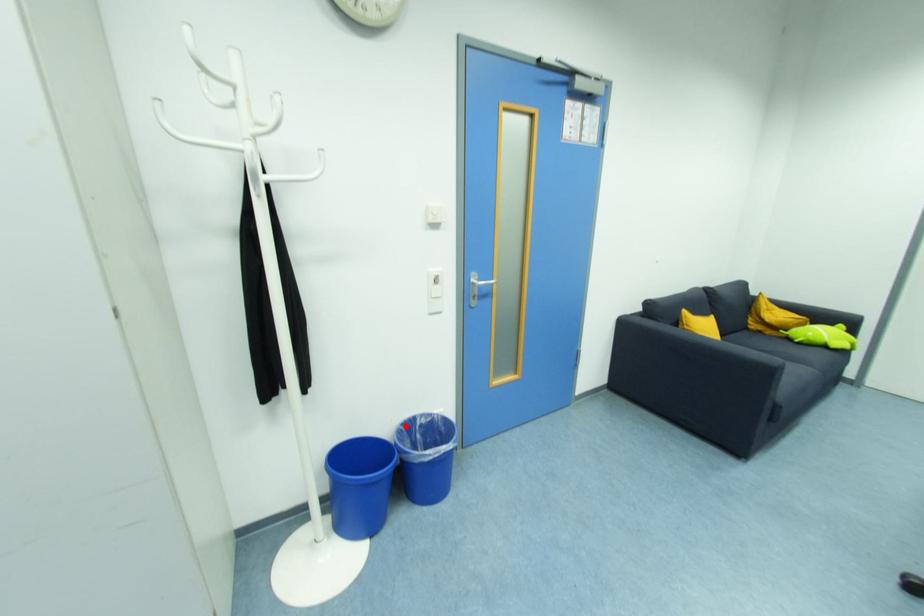
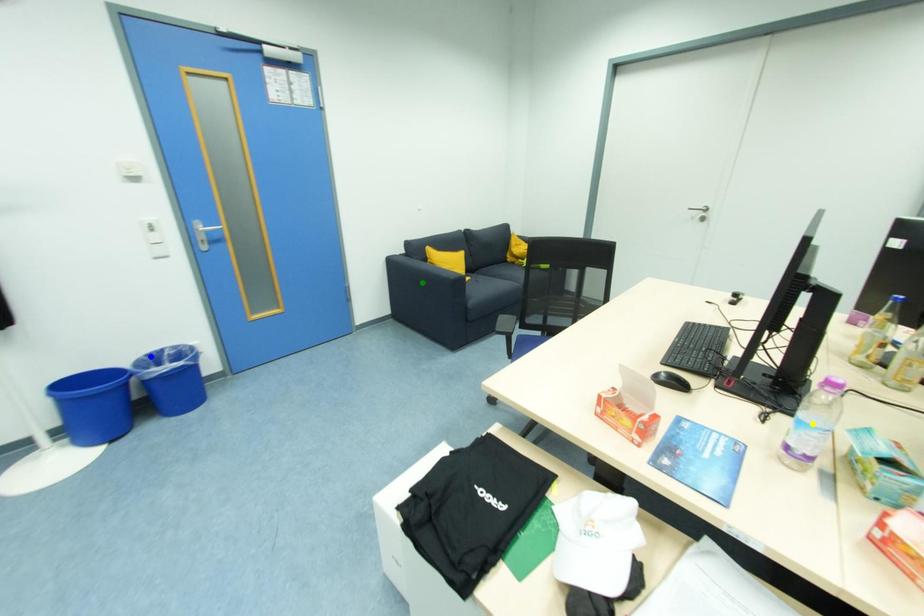
Question: I am providing you with two images of the same scene from different viewpoints. A red point is marked on the first image. You are given multiple points on the second image. Which point in image 2 represents the same 3d spot as the red point in image 1?

Choices:
 (A) green point
 (B) blue point
 (C) yellow point

Answer: (B)